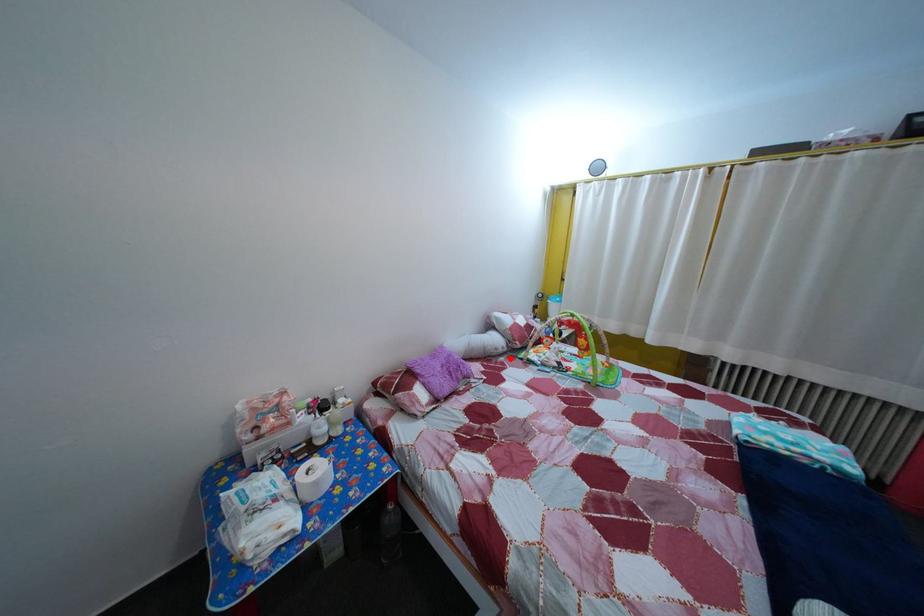
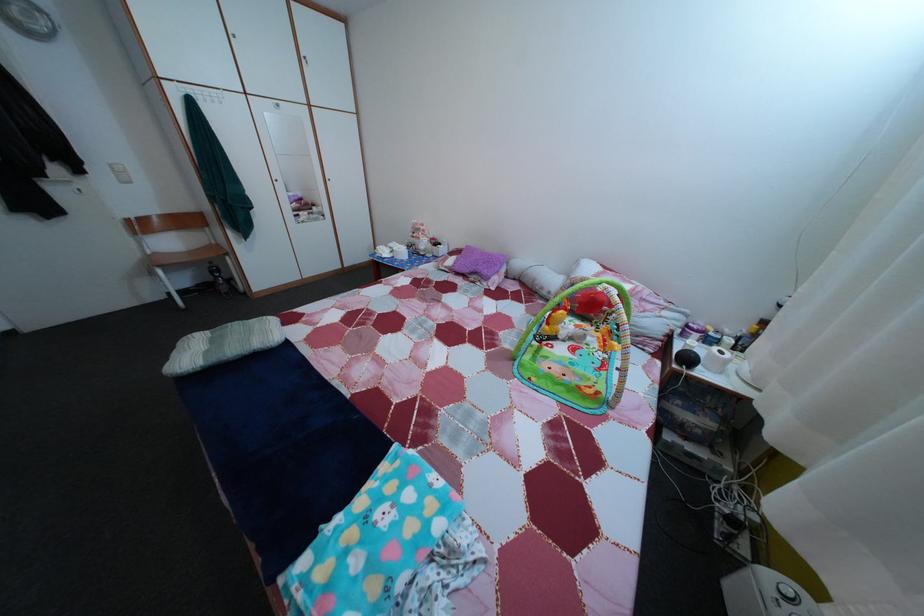
Question: I am providing you with two images of the same scene from different viewpoints. In image1, a red point is highlighted. Considering the same 3D point in image2, which of the following is correct?

Choices:
 (A) It is closer
 (B) It is farther

Answer: (A)